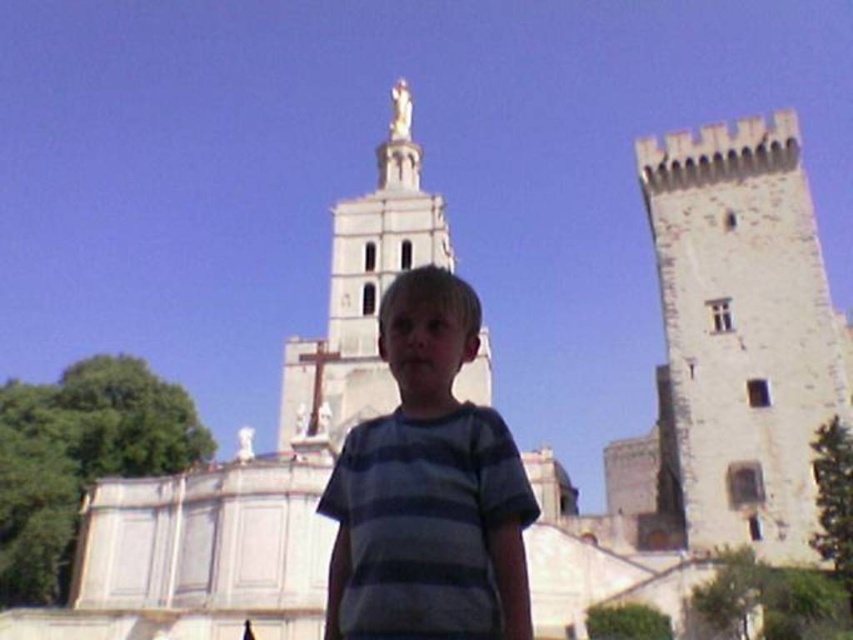
You are a photographer adjusting your camera to capture the historic stone structure. You notice two points marked in the scene. Which point, point (x=383, y=636) or point (x=396, y=250), is closer to your camera lens?

Point (x=383, y=636) is closer to the camera lens than point (x=396, y=250).

You are a photographer trying to capture the boy in the striped cotton shirt at center and the white stone tower at center. Based on their sizes, which one would appear narrower in the photo?

The striped cotton shirt at center is thinner than the white stone tower at center, so the striped cotton shirt at center would appear narrower in the photo.

The young boy is wearing a striped cotton shirt at center and standing in front of a white stone tower at center. Which object takes up more space in the image?

The white stone tower at center takes up more space in the image than the striped cotton shirt at center because the striped cotton shirt at center occupies less space than white stone tower at center.